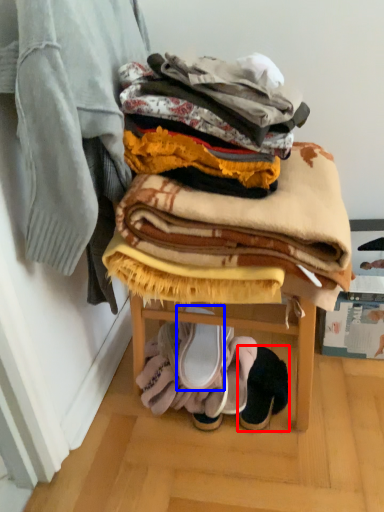
Question: Which of the following is the farthest to the observer, footwear (highlighted by a red box) or footwear (highlighted by a blue box)?

Choices:
 (A) footwear
 (B) footwear

Answer: (A)